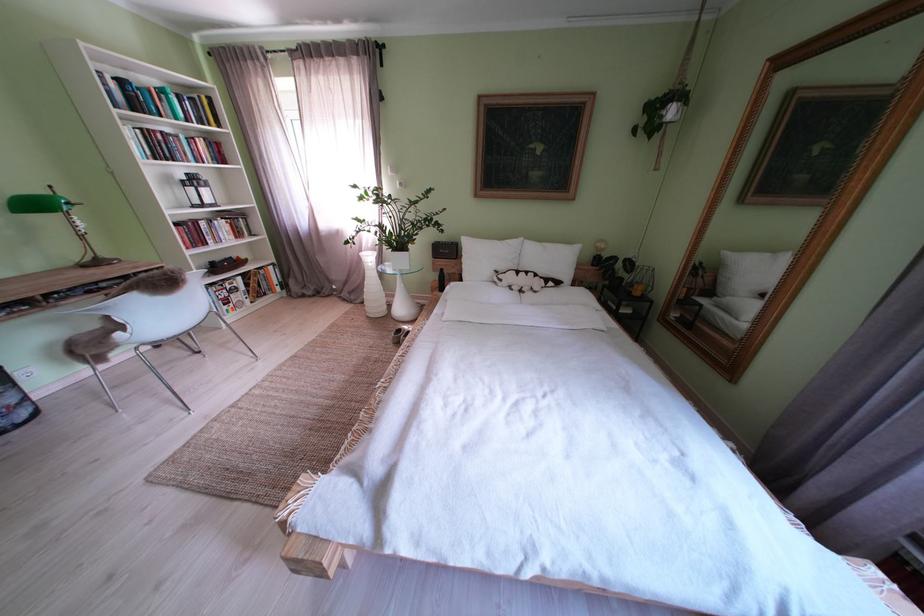
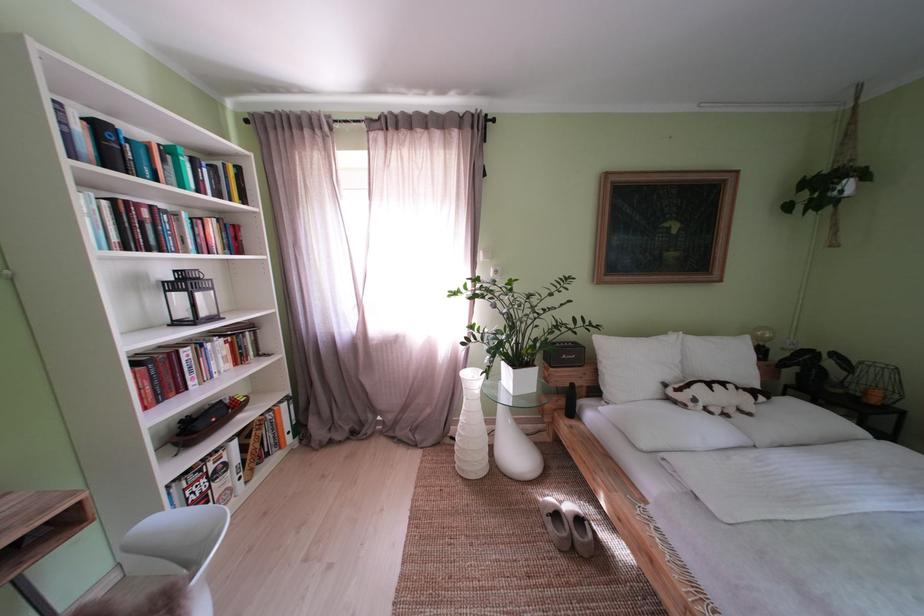
The point at (410,336) is marked in the first image. Where is the corresponding point in the second image?

(567, 521)